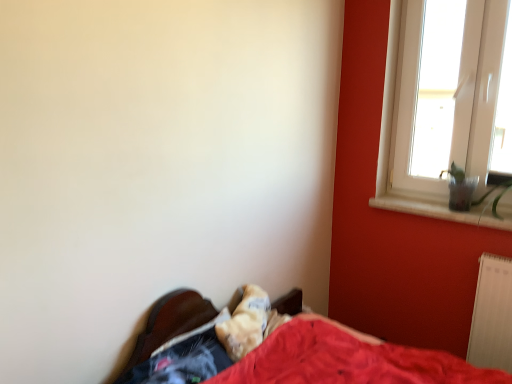
The height and width of the screenshot is (384, 512). Describe the element at coordinates (445, 210) in the screenshot. I see `white marble window sill at right` at that location.

Find the location of a particular element. white marble window sill at right is located at coordinates (445, 210).

Where is `white marble window sill at right`? white marble window sill at right is located at coordinates (445, 210).